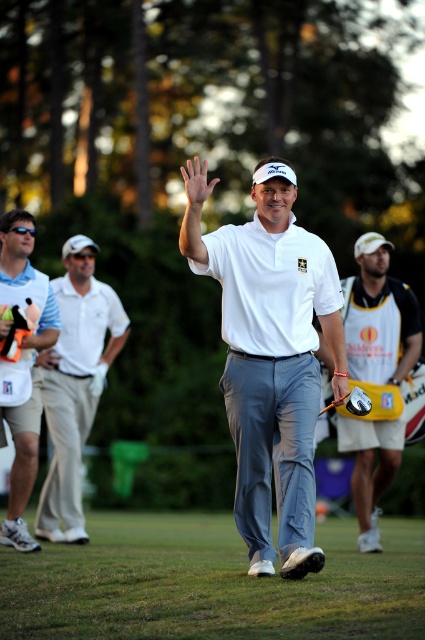
Consider the image. You are a spectator at the golf tournament and want to know which item is taller between the yellow and black golf bag at right and the white cotton polo shirt at left. Can you tell me?

The yellow and black golf bag at right is taller than the white cotton polo shirt at left.

You are a photographer positioned at the center of the golf course. You want to take a photo of both the white matte shirt at center and the white cotton polo shirt at left in the same frame. The camera you are using has a maximum focus range of 4 meters. Will both subjects be within the focus range?

The white matte shirt at center and white cotton polo shirt at left are 4.23 meters apart from each other. Since the camera can only focus within 4 meters, the distance between them exceeds the focus range, so both subjects cannot be in focus at the same time.